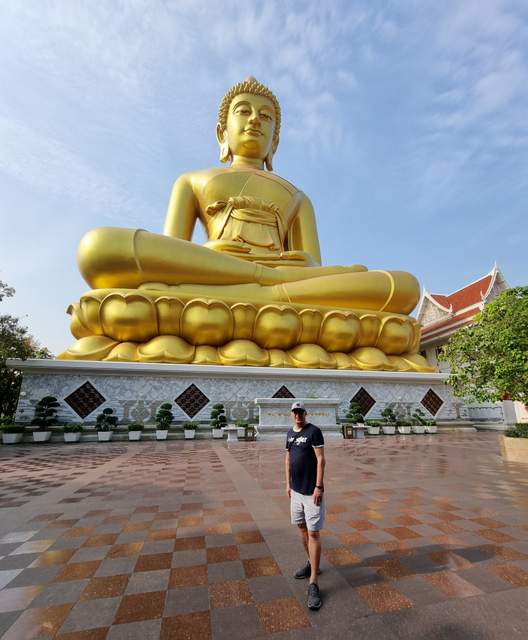
Identify the location of pedastal. The height and width of the screenshot is (640, 528). (235, 376).